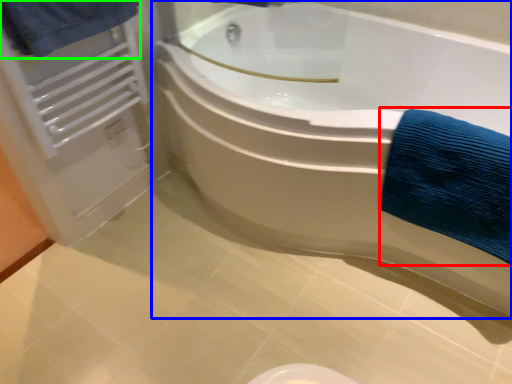
Question: Based on their relative distances, which object is nearer to bath towel (highlighted by a red box)? Choose from bathtub (highlighted by a blue box) and bath towel (highlighted by a green box).

Choices:
 (A) bathtub
 (B) bath towel

Answer: (A)